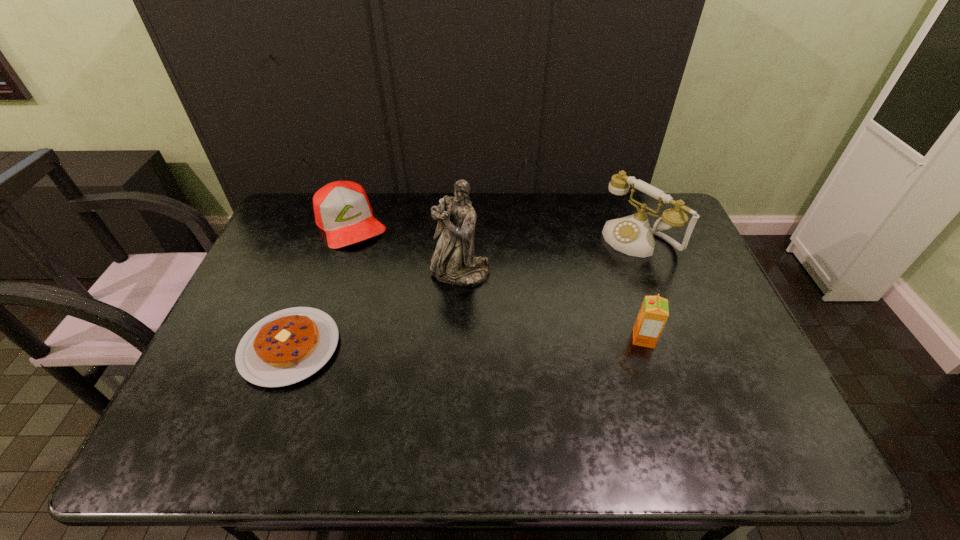
This screenshot has width=960, height=540. What are the coordinates of `vacant area that lies between the second tallest object and the orange juice` in the screenshot? It's located at (641, 289).

Identify which object is located as the second nearest to the second shortest object. Please provide its 2D coordinates. Your answer should be formatted as a tuple, i.e. [(x, y)], where the tuple contains the x and y coordinates of a point satisfying the conditions above.

[(285, 347)]

Select which object appears as the third closest to the baseball cap. Please provide its 2D coordinates. Your answer should be formatted as a tuple, i.e. [(x, y)], where the tuple contains the x and y coordinates of a point satisfying the conditions above.

[(632, 235)]

Image resolution: width=960 pixels, height=540 pixels. What are the coordinates of `free space that satisfies the following two spatial constraints: 1. on the front side of the telephone; 2. on the left side of the second shortest object` in the screenshot? It's located at (346, 239).

At what (x,y) coordinates should I click in order to perform the action: click on free region that satisfies the following two spatial constraints: 1. on the front side of the third shortest object; 2. on the right side of the baseball cap. Please return your answer as a coordinate pair (x, y). The image size is (960, 540). Looking at the image, I should click on (312, 339).

Locate an element on the screen. The width and height of the screenshot is (960, 540). vacant area in the image that satisfies the following two spatial constraints: 1. on the back side of the fourth shortest object; 2. on the left side of the pancake is located at coordinates (330, 239).